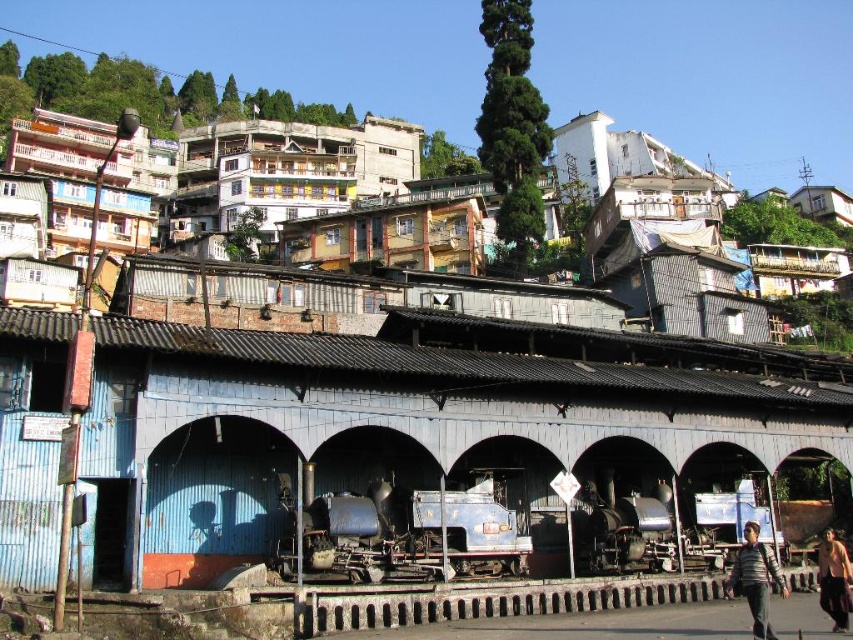
You are a photographer standing at the entrance of the train shed. You want to take a photo of the striped sweater at lower right and the skinny man at lower right. Which one of them is narrower in width?

The striped sweater at lower right is thinner than the skinny man at lower right, so the striped sweater at lower right is narrower in width.